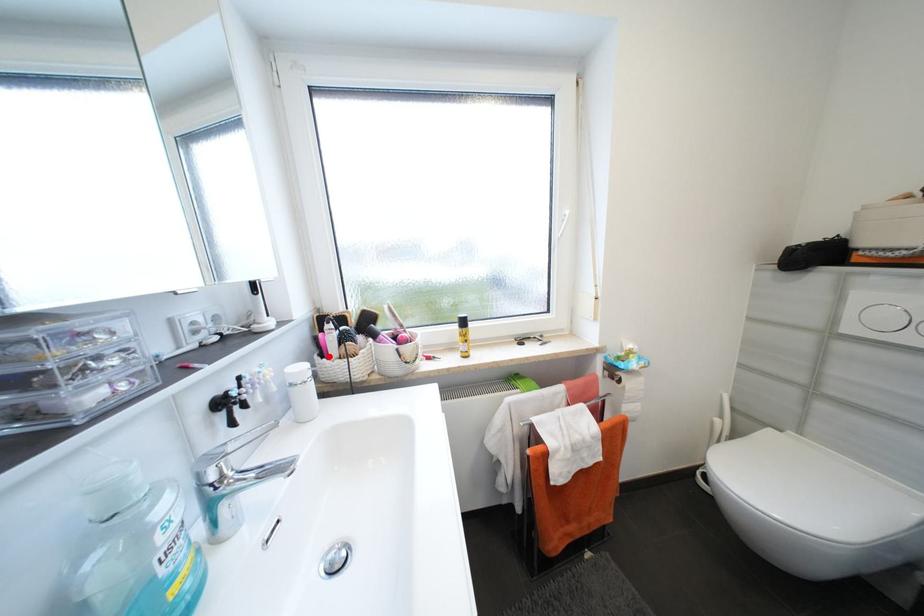
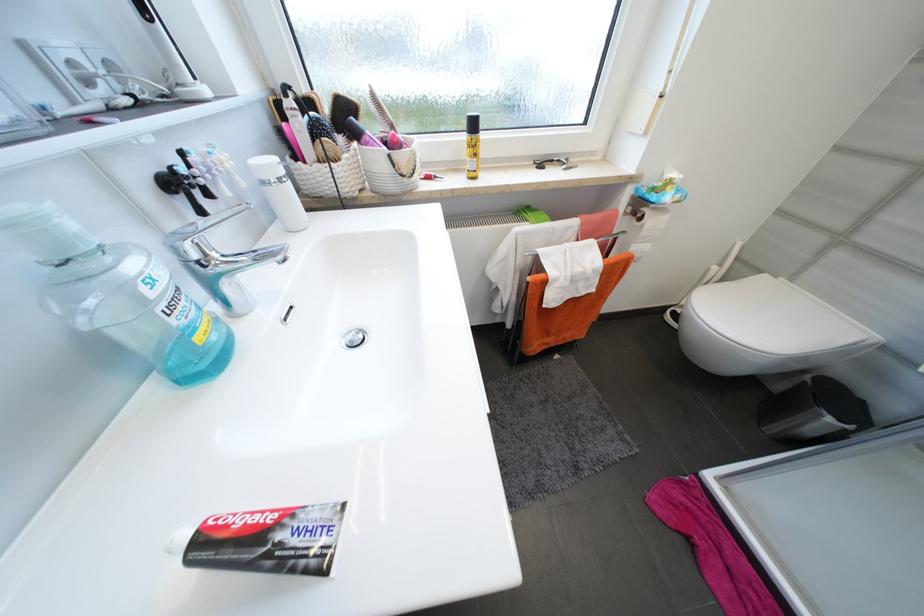
Locate, in the second image, the point that corresponds to the highlighted location in the first image.

(304, 158)